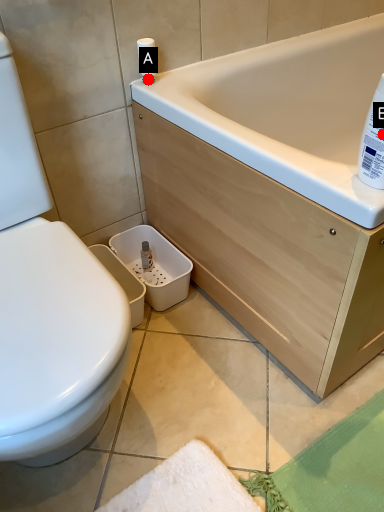
Question: Two points are circled on the image, labeled by A and B beside each circle. Which point is closer to the camera?

Choices:
 (A) A is closer
 (B) B is closer

Answer: (B)